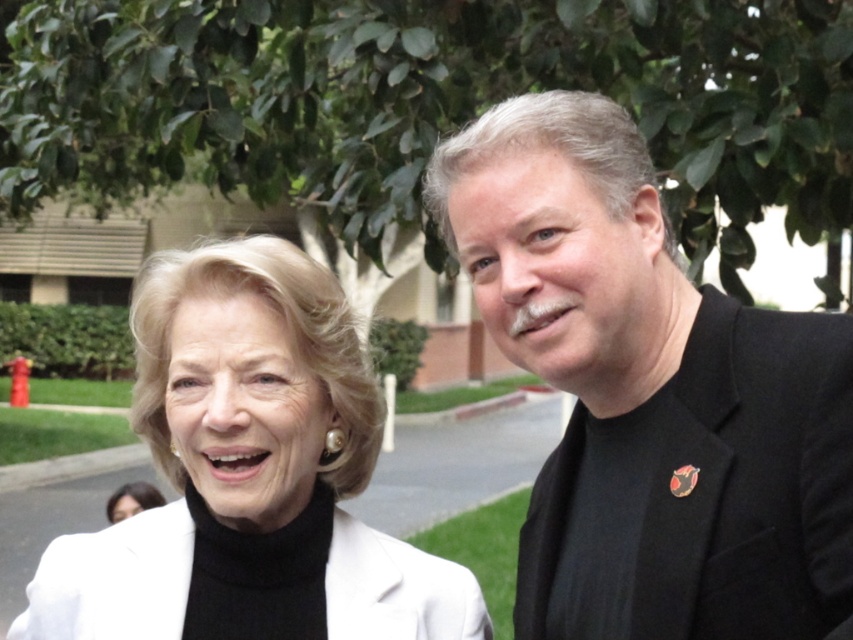
You are an event organizer who needs to ensure that the white matte jacket at upper left and the white matte blazer at lower left can both fit on a display rack that has a maximum capacity of accommodating the larger of the two items. Based on the image, which item will require more space on the rack?

The white matte jacket at upper left requires more space on the rack because it is larger in size than the white matte blazer at lower left according to the description.